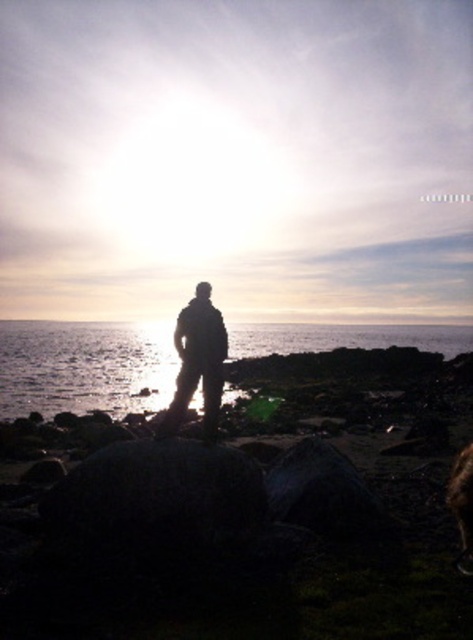
Question: From the image, what is the correct spatial relationship of silhouette fabric at center in relation to fuzzy brown dog at lower right?

Choices:
 (A) right
 (B) left

Answer: (B)

Question: From the image, what is the correct spatial relationship of silhouette fabric at center in relation to fuzzy brown dog at lower right?

Choices:
 (A) right
 (B) left

Answer: (B)

Question: Is silhouette fabric at center to the left of fuzzy brown dog at lower right from the viewer's perspective?

Choices:
 (A) yes
 (B) no

Answer: (A)

Question: Which object appears closest to the camera in this image?

Choices:
 (A) fuzzy brown dog at lower right
 (B) transparent water at center
 (C) silhouette fabric at center

Answer: (A)

Question: Which of these objects is positioned farthest from the transparent water at center?

Choices:
 (A) fuzzy brown dog at lower right
 (B) silhouette fabric at center

Answer: (B)

Question: Considering the real-world distances, which object is closest to the silhouette fabric at center?

Choices:
 (A) transparent water at center
 (B) fuzzy brown dog at lower right

Answer: (B)